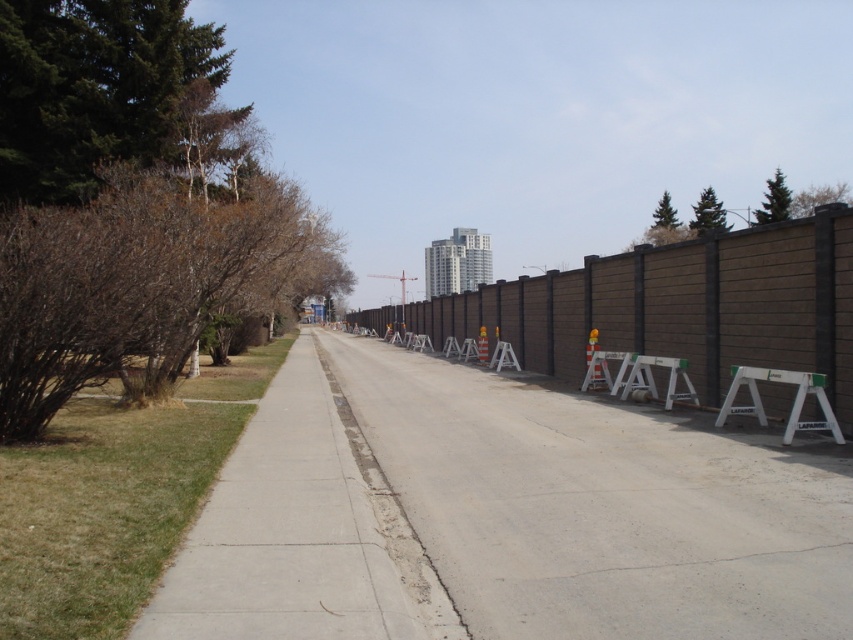
You are a delivery robot that needs to navigate through the construction site. You see the gray concrete pavement at center and the white plastic sawhorse at right. Which path should you choose to ensure you can pass through without getting stuck?

The gray concrete pavement at center is wider than the white plastic sawhorse at right, so you should choose the gray concrete pavement at center to ensure you can pass through without getting stuck.

You are a delivery person with a cart that is 2 meters wide. You see the gray concrete sidewalk at lower left and the white plastic sawhorse at right. Can your cart fit through the space between them?

The gray concrete sidewalk at lower left is 6.18 meters from the white plastic sawhorse at right. Since your cart is only 2 meters wide, it can easily fit through the space between them.